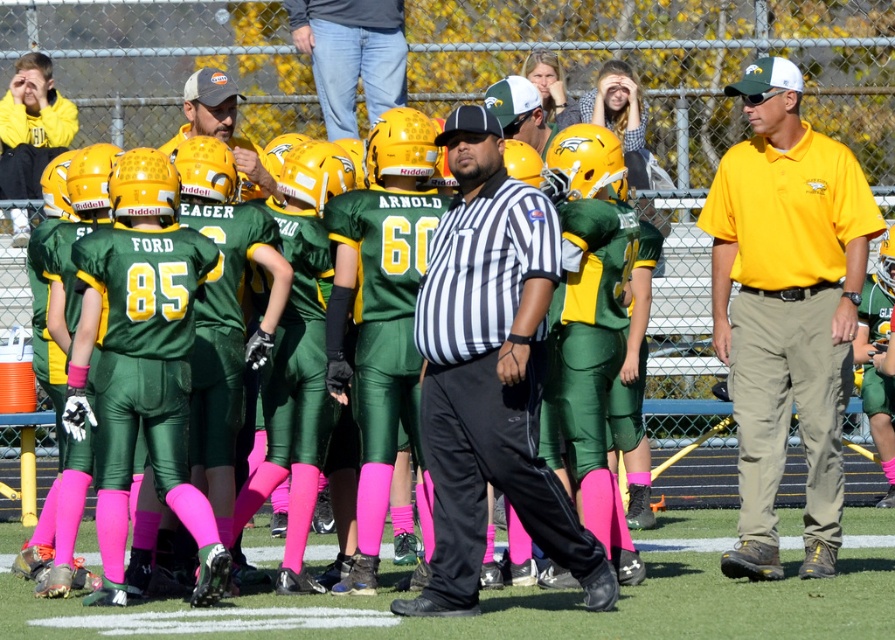
Based on the coordinates provided, what object is located at point (x=489, y=360) in the image?

The point (x=489, y=360) corresponds to the green matte uniform at center.

You are a coach standing at the edge of the field. You need to quickly move from your position to the yellow cotton shirt at center and then to the matte yellow helmet at upper left. Can you reach both within 10 seconds if you run at a constant speed of 3 m per second?

The distance between the yellow cotton shirt at center and the matte yellow helmet at upper left is 8.92 meters. To cover this distance at 3 m per second would take approximately 2.97 seconds. Adding the time to reach the first object from the starting point, the total time would depend on the initial distance from the coach to the yellow cotton shirt. However, since the total distance between both objects is under 10 meters, if the coach is already near the yellow cotton shirt, it might be possible within

Based on the scene described, which object is shorter between the green matte uniform at center and the yellow cotton shirt at center?

The green matte uniform at center is shorter than the yellow cotton shirt at center.